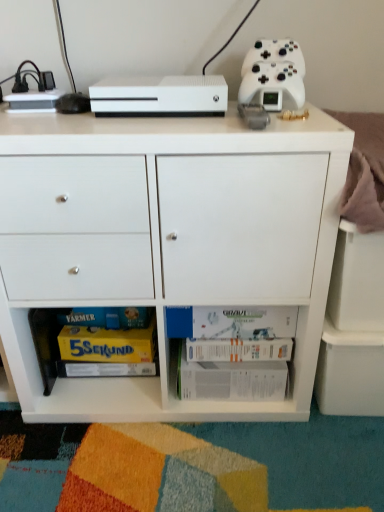
In order to face yellow cardboard magazine at lower left, should I rotate leftwards or rightwards?

You should look left and rotate roughly 11.609 degrees.

The image size is (384, 512). What do you see at coordinates (108, 344) in the screenshot?
I see `yellow cardboard magazine at lower left` at bounding box center [108, 344].

At what (x,y) coordinates should I click in order to perform the action: click on white matte board game at lower center, placed as the 2th book when sorted from bottom to top. Please return your answer as a coordinate pair (x, y). Image resolution: width=384 pixels, height=512 pixels. Looking at the image, I should click on (232, 322).

The width and height of the screenshot is (384, 512). Find the location of `yellow cardboard magazine at lower left`. yellow cardboard magazine at lower left is located at coordinates (108, 344).

Do you think white matte controller at upper right is within white matte cabinet at center, or outside of it?

white matte controller at upper right is located beyond the bounds of white matte cabinet at center.

Is white matte controller at upper right shorter than white matte cabinet at center?

Yes.

Between white matte controller at upper right and white matte cabinet at center, which one is positioned in front?

white matte cabinet at center is more forward.

Based on their sizes in the image, would you say white matte controller at upper right is bigger or smaller than white matte cabinet at center?

Clearly, white matte controller at upper right is smaller in size than white matte cabinet at center.

Can you confirm if white matte xbox one s at upper center is wider than yellow cardboard magazine at lower left?

Correct, the width of white matte xbox one s at upper center exceeds that of yellow cardboard magazine at lower left.

From a real-world perspective, which is physically below, white matte xbox one s at upper center or yellow cardboard magazine at lower left?

From a 3D spatial view, yellow cardboard magazine at lower left is below.

You are a GUI agent. You are given a task and a screenshot of the screen. Output one action in this format:
    pyautogui.click(x=<x>, y=<y>)
    Task: Click on the printer above the yellow cardboard magazine at lower left (from the image's perspective)
    
    Given the screenshot: What is the action you would take?
    pyautogui.click(x=160, y=96)

Which of these two, white matte xbox one s at upper center or yellow cardboard magazine at lower left, is smaller?

Smaller between the two is yellow cardboard magazine at lower left.

In the scene shown: Is white matte cabinet at center shorter than white paper book at lower center, which appears as the first book when ordered from the bottom?

Incorrect, the height of white matte cabinet at center does not fall short of that of white paper book at lower center, which appears as the first book when ordered from the bottom.

Measure the distance between white matte cabinet at center and white paper book at lower center, which appears as the first book when ordered from the bottom.

They are 7.74 inches apart.

You are a GUI agent. You are given a task and a screenshot of the screen. Output one action in this format:
    pyautogui.click(x=<x>, y=<y>)
    Task: Click on the chest of drawers above the white paper book at lower center, the 2th book in the top-to-bottom sequence (from the image's perspective)
    This screenshot has width=384, height=512.
    Given the screenshot: What is the action you would take?
    pyautogui.click(x=165, y=242)

Is white matte cabinet at center spatially inside white paper book at lower center, which appears as the first book when ordered from the bottom, or outside of it?

white matte cabinet at center is spatially situated outside white paper book at lower center, which appears as the first book when ordered from the bottom.

Is white matte board game at lower center, the 1th book from the top, facing towards yellow cardboard magazine at lower left?

No, white matte board game at lower center, the 1th book from the top, is not turned towards yellow cardboard magazine at lower left.

Is white matte board game at lower center, placed as the 2th book when sorted from bottom to top, wider than yellow cardboard magazine at lower left?

Yes, white matte board game at lower center, placed as the 2th book when sorted from bottom to top, is wider than yellow cardboard magazine at lower left.

Choose the correct answer: Is white matte board game at lower center, placed as the 2th book when sorted from bottom to top, inside yellow cardboard magazine at lower left or outside it?

white matte board game at lower center, placed as the 2th book when sorted from bottom to top, cannot be found inside yellow cardboard magazine at lower left.

Considering the sizes of yellow cardboard magazine at lower left and white matte cabinet at center in the image, is yellow cardboard magazine at lower left taller or shorter than white matte cabinet at center?

Clearly, yellow cardboard magazine at lower left is shorter compared to white matte cabinet at center.

Consider the image. Relative to white matte cabinet at center, is yellow cardboard magazine at lower left in front or behind?

yellow cardboard magazine at lower left is behind white matte cabinet at center.

Is there a large distance between yellow cardboard magazine at lower left and white matte cabinet at center?

No.

Is yellow cardboard magazine at lower left looking in the opposite direction of white matte cabinet at center?

Yes, yellow cardboard magazine at lower left's orientation is away from white matte cabinet at center.

Which point is more distant from viewer, (x=127, y=101) or (x=239, y=347)?

Point (x=239, y=347)

Between white matte xbox one s at upper center and white paper book at lower center, the 2th book in the top-to-bottom sequence, which one has larger size?

With larger size is white paper book at lower center, the 2th book in the top-to-bottom sequence.

Would you say white paper book at lower center, which appears as the first book when ordered from the bottom, is part of white matte xbox one s at upper center's contents?

No, white paper book at lower center, which appears as the first book when ordered from the bottom, is located outside of white matte xbox one s at upper center.

From a real-world perspective, is white matte xbox one s at upper center below white paper book at lower center, which appears as the first book when ordered from the bottom?

Actually, white matte xbox one s at upper center is physically above white paper book at lower center, which appears as the first book when ordered from the bottom, in the real world.

How many degrees apart are the facing directions of white matte cabinet at center and white matte board game at lower center, the 1th book from the top?

They differ by 1.9 degrees in their facing directions.

Does white matte cabinet at center lie behind white matte board game at lower center, placed as the 2th book when sorted from bottom to top?

No, white matte cabinet at center is closer to the viewer.

Does point (306, 305) come farther from viewer compared to point (290, 327)?

No, (306, 305) is in front of (290, 327).

Identify the location of appliance above the white matte cabinet at center (from a real-world perspective). The width and height of the screenshot is (384, 512). (273, 75).

Where is `printer above the yellow cardboard magazine at lower left (from the image's perspective)`? The height and width of the screenshot is (512, 384). printer above the yellow cardboard magazine at lower left (from the image's perspective) is located at coordinates pyautogui.click(x=160, y=96).

Looking at the image, which one is located further to white paper book at lower center, the 2th book in the top-to-bottom sequence, yellow cardboard magazine at lower left or white matte cabinet at center?

Among the two, yellow cardboard magazine at lower left is located further to white paper book at lower center, the 2th book in the top-to-bottom sequence.

Looking at the image, which one is located further to yellow cardboard magazine at lower left, white matte controller at upper right or white matte xbox one s at upper center?

Based on the image, white matte controller at upper right appears to be further to yellow cardboard magazine at lower left.

Which object lies further to the anchor point white paper book at lower center, the 2th book in the top-to-bottom sequence, white matte xbox one s at upper center or white matte board game at lower center, the 1th book from the top?

Among the two, white matte xbox one s at upper center is located further to white paper book at lower center, the 2th book in the top-to-bottom sequence.

Looking at the image, which one is located closer to white matte board game at lower center, the 1th book from the top, white matte cabinet at center or white matte xbox one s at upper center?

The object closer to white matte board game at lower center, the 1th book from the top, is white matte cabinet at center.

Looking at the image, which one is located closer to white matte cabinet at center, white matte board game at lower center, the 1th book from the top, or white paper book at lower center, which appears as the first book when ordered from the bottom?

white paper book at lower center, which appears as the first book when ordered from the bottom.

When comparing their distances from yellow cardboard magazine at lower left, does white paper book at lower center, the 2th book in the top-to-bottom sequence, or white matte xbox one s at upper center seem further?

white matte xbox one s at upper center is positioned further to the anchor yellow cardboard magazine at lower left.

Considering their positions, is white matte board game at lower center, placed as the 2th book when sorted from bottom to top, positioned closer to white matte controller at upper right than yellow cardboard magazine at lower left?

white matte board game at lower center, placed as the 2th book when sorted from bottom to top, lies closer to white matte controller at upper right than the other object.

Looking at the image, which one is located further to white matte xbox one s at upper center, white matte board game at lower center, the 1th book from the top, or yellow cardboard magazine at lower left?

yellow cardboard magazine at lower left is further to white matte xbox one s at upper center.

This screenshot has height=512, width=384. In order to click on chest of drawers between white matte controller at upper right and yellow cardboard magazine at lower left in the vertical direction in this screenshot , I will do `click(165, 242)`.

Locate an element on the screen. This screenshot has height=512, width=384. book that lies between white matte controller at upper right and yellow cardboard magazine at lower left from top to bottom is located at coordinates (232, 322).

The height and width of the screenshot is (512, 384). I want to click on book located between white matte cabinet at center and white paper book at lower center, which appears as the first book when ordered from the bottom, in the depth direction, so click(x=232, y=322).

In order to click on book between white matte xbox one s at upper center and white paper book at lower center, the 2th book in the top-to-bottom sequence, in the up-down direction in this screenshot , I will do `click(232, 322)`.